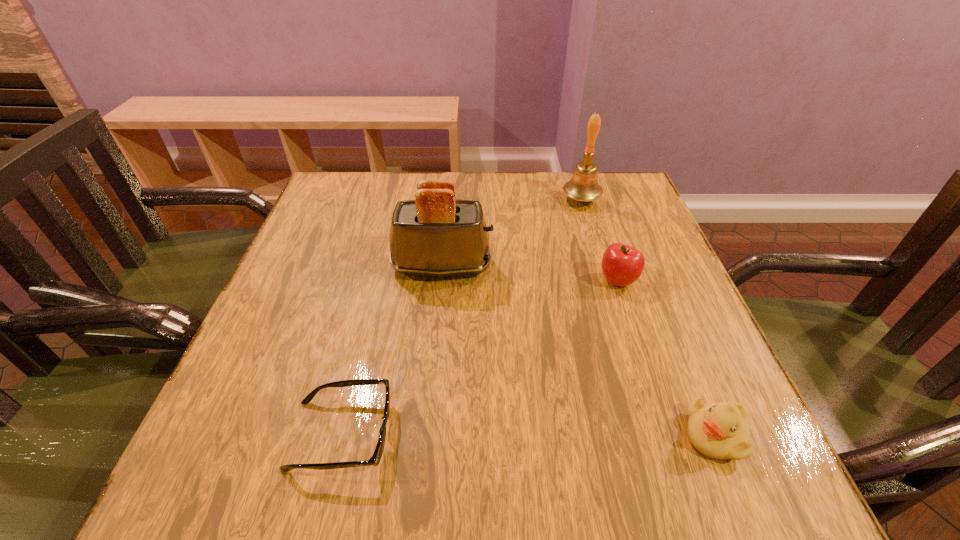
Locate an element on the screen. This screenshot has width=960, height=540. vacant region between the toaster and the apple is located at coordinates (530, 273).

The image size is (960, 540). Find the location of `vacant area that lies between the spectacles and the farthest object`. vacant area that lies between the spectacles and the farthest object is located at coordinates (461, 317).

Find the location of a particular element. This screenshot has height=540, width=960. vacant space that's between the toaster and the farthest object is located at coordinates (512, 233).

In order to click on vacant space that is in between the toaster and the farthest object in this screenshot , I will do `click(512, 233)`.

Identify the location of free area in between the duckling and the toaster. pyautogui.click(x=579, y=350).

I want to click on free spot between the third tallest object and the spectacles, so click(x=479, y=357).

This screenshot has width=960, height=540. Identify the location of empty location between the farthest object and the spectacles. (461, 317).

Where is `empty location between the apple and the duckling`? This screenshot has height=540, width=960. empty location between the apple and the duckling is located at coordinates (666, 357).

You are a GUI agent. You are given a task and a screenshot of the screen. Output one action in this format:
    pyautogui.click(x=<x>, y=<y>)
    Task: Click on the free space that is in between the shortest object and the farthest object
    
    Given the screenshot: What is the action you would take?
    pyautogui.click(x=461, y=317)

Where is `object that is the second closest to the duckling`? This screenshot has width=960, height=540. object that is the second closest to the duckling is located at coordinates (435, 235).